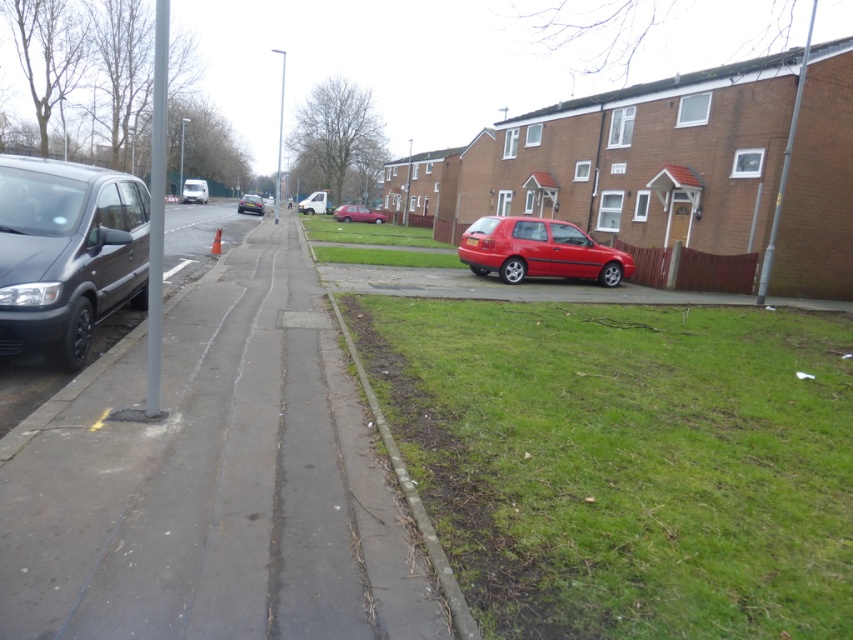
Based on the photo, you are a pedestrian standing on the sidewalk and want to cross the street to reach the brick houses. You see the matte black van at left and the matte red hatchback at center. Which vehicle is closer to you?

The matte black van at left is closer to you because it is in front of the matte red hatchback at center.

You are a gardener planning to mow the green grass at center and the white matte van at center. Which area requires more time to mow?

The green grass at center requires more time to mow because it is bigger than the white matte van at center.